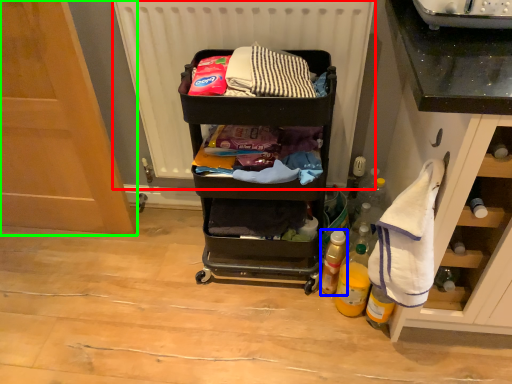
Question: Which object is the farthest from radiator (highlighted by a red box)? Choose among these: bottle (highlighted by a blue box) or door (highlighted by a green box).

Choices:
 (A) bottle
 (B) door

Answer: (A)